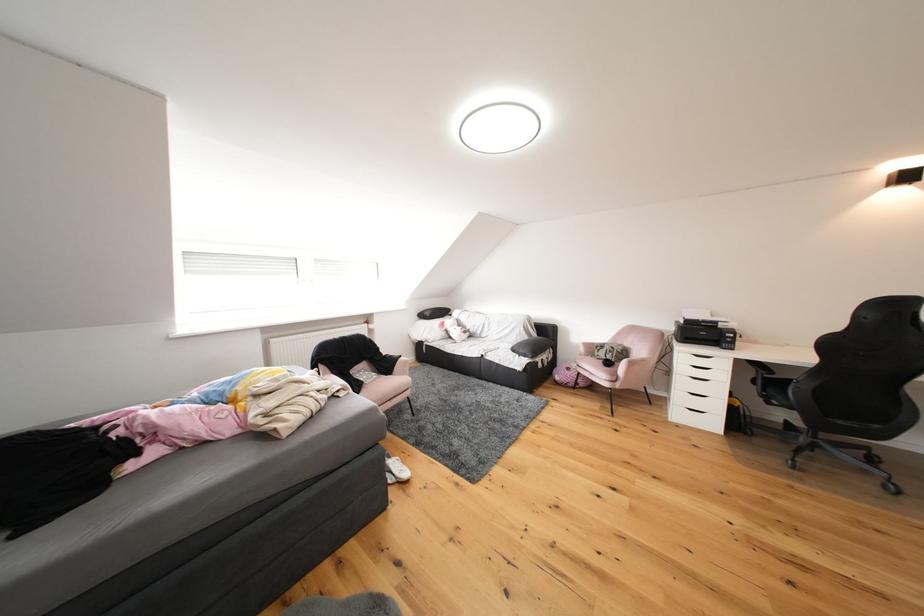
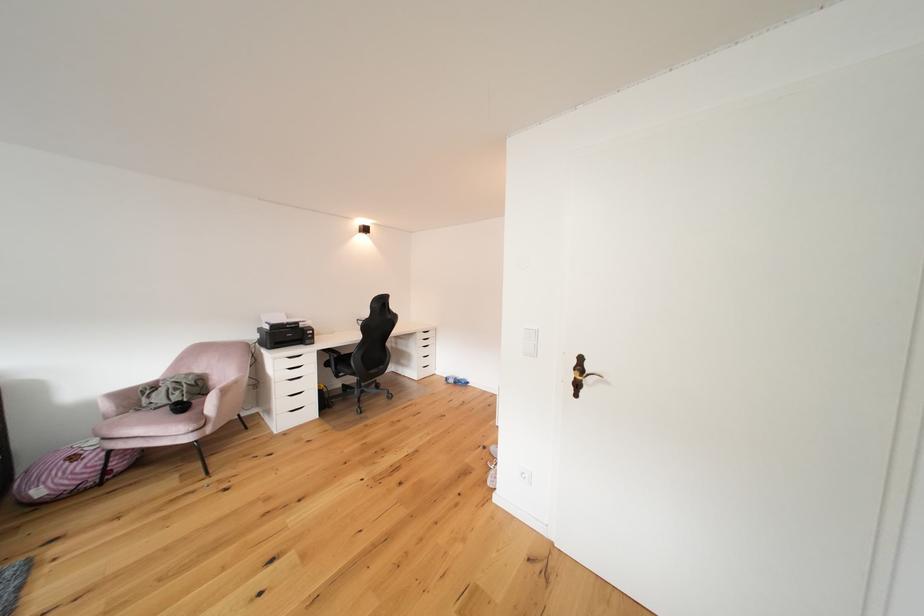
Question: The first image is from the beginning of the video and the second image is from the end. How did the camera likely rotate when shooting the video?

Choices:
 (A) Left
 (B) Right
 (C) Up
 (D) Down

Answer: (B)